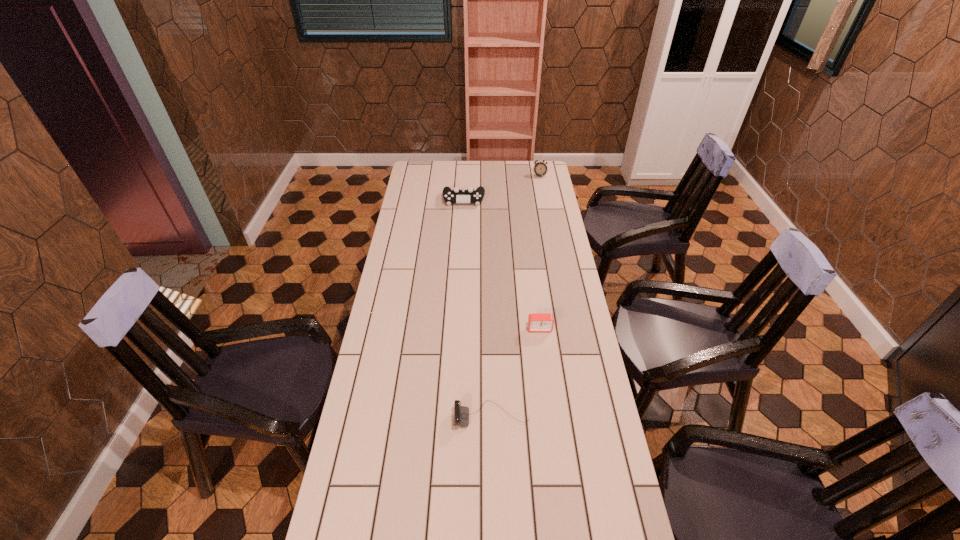
I want to click on vacant region between the rightmost object and the control, so click(502, 188).

Where is `empty location between the taller alarm clock and the shortest object`? This screenshot has height=540, width=960. empty location between the taller alarm clock and the shortest object is located at coordinates (x=516, y=296).

Where is `vacant space that's between the nearest object and the left alarm clock`? vacant space that's between the nearest object and the left alarm clock is located at coordinates (516, 372).

At what (x,y) coordinates should I click in order to perform the action: click on vacant region between the second object from right to left and the rightmost object. Please return your answer as a coordinate pair (x, y). Image resolution: width=960 pixels, height=540 pixels. Looking at the image, I should click on (540, 252).

Identify the location of free space between the third nearest object and the webcam. The width and height of the screenshot is (960, 540). (478, 308).

Where is `empty space between the tallest object and the webcam`? The image size is (960, 540). empty space between the tallest object and the webcam is located at coordinates (516, 296).

Identify the location of object that is the third closest to the third nearest object. Image resolution: width=960 pixels, height=540 pixels. (461, 413).

You are a GUI agent. You are given a task and a screenshot of the screen. Output one action in this format:
    pyautogui.click(x=<x>, y=<y>)
    Task: Click on the closest object to the shorter alarm clock
    Image resolution: width=960 pixels, height=540 pixels.
    Given the screenshot: What is the action you would take?
    pyautogui.click(x=461, y=413)

Identify the location of vacant region that satisfies the following two spatial constraints: 1. on the front-facing side of the nearer alarm clock; 2. on the front-facing side of the shortest object. (551, 416).

You are a GUI agent. You are given a task and a screenshot of the screen. Output one action in this format:
    pyautogui.click(x=<x>, y=<y>)
    Task: Click on the vacant area that satisfies the following two spatial constraints: 1. on the face of the right alarm clock; 2. on the front-facing side of the shortest object
    The image size is (960, 540).
    Given the screenshot: What is the action you would take?
    pyautogui.click(x=586, y=416)